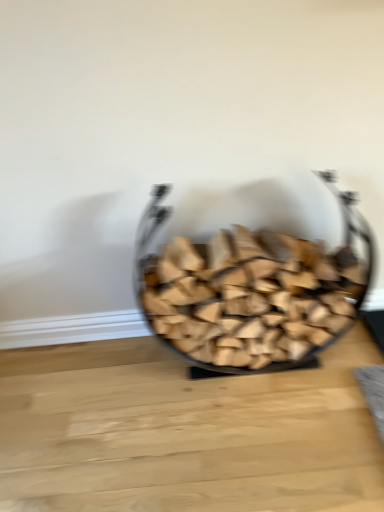
This screenshot has height=512, width=384. I want to click on vacant area on top of natural wood table at center (from a real-world perspective), so click(183, 413).